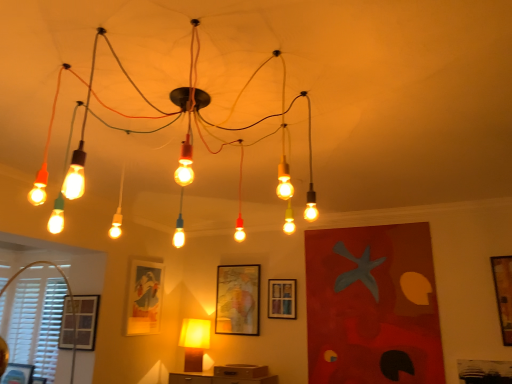
What do you see at coordinates (238, 300) in the screenshot? The height and width of the screenshot is (384, 512). I see `wooden framed map at center, marked as the 3th picture frame in a right-to-left arrangement` at bounding box center [238, 300].

This screenshot has width=512, height=384. Describe the element at coordinates (70, 298) in the screenshot. I see `white plastic blinds at lower left` at that location.

Identify the location of matte glass light fixture at center, the second lamp when ordered from bottom to top. (197, 93).

Describe the element at coordinates (194, 342) in the screenshot. I see `matte yellow lamp at center, the second lamp positioned from the top` at that location.

Describe the element at coordinates (282, 298) in the screenshot. The image size is (512, 384). I see `wooden picture frame at center, the fifth picture frame when ordered from left to right` at that location.

How much space does wooden picture frame at lower left, which is counted as the first picture frame, starting from the left, occupy vertically?

7.97 inches.

The width and height of the screenshot is (512, 384). What do you see at coordinates (144, 298) in the screenshot? I see `matte glass picture frame at center left, arranged as the third picture frame when viewed from the left` at bounding box center [144, 298].

You are a GUI agent. You are given a task and a screenshot of the screen. Output one action in this format:
    pyautogui.click(x=<x>, y=<y>)
    Task: Click on the matte black picture frame at lower left, the 5th picture frame positioned from the right
    
    Given the screenshot: What is the action you would take?
    pyautogui.click(x=86, y=320)

Are matte glass light fixture at center, the second lamp when ordered from bottom to top, and wooden picture frame at lower left, the 6th picture frame from the right, beside each other?

No, matte glass light fixture at center, the second lamp when ordered from bottom to top, is not beside wooden picture frame at lower left, the 6th picture frame from the right.

Considering the sizes of objects matte glass light fixture at center, the 1th lamp viewed from the front, and wooden picture frame at lower left, the 6th picture frame from the right, in the image provided, who is taller, matte glass light fixture at center, the 1th lamp viewed from the front, or wooden picture frame at lower left, the 6th picture frame from the right,?

Standing taller between the two is matte glass light fixture at center, the 1th lamp viewed from the front.

Considering the positions of objects matte glass light fixture at center, the first lamp when ordered from top to bottom, and wooden picture frame at lower left, which is counted as the first picture frame, starting from the left, in the image provided, who is in front, matte glass light fixture at center, the first lamp when ordered from top to bottom, or wooden picture frame at lower left, which is counted as the first picture frame, starting from the left,?

matte glass light fixture at center, the first lamp when ordered from top to bottom, is in front.

Visually, is matte glass light fixture at center, the second lamp when ordered from bottom to top, positioned to the left or to the right of wooden picture frame at lower left, which is counted as the first picture frame, starting from the left?

matte glass light fixture at center, the second lamp when ordered from bottom to top, is positioned on wooden picture frame at lower left, which is counted as the first picture frame, starting from the left,'s right side.

From the image's perspective, who appears lower, wooden picture frame at center, the 2th picture frame when ordered from right to left, or wooden picture frame at lower left, which is counted as the first picture frame, starting from the left?

wooden picture frame at lower left, which is counted as the first picture frame, starting from the left, is shown below in the image.

From a real-world perspective, is wooden picture frame at center, the 2th picture frame when ordered from right to left, positioned over wooden picture frame at lower left, which is counted as the first picture frame, starting from the left, based on gravity?

Yes, from a real-world perspective, wooden picture frame at center, the 2th picture frame when ordered from right to left, is above wooden picture frame at lower left, which is counted as the first picture frame, starting from the left.

Is wooden picture frame at center, the 2th picture frame when ordered from right to left, closer to camera compared to wooden picture frame at lower left, which is counted as the first picture frame, starting from the left?

That is False.

Is matte yellow lamp at center, which appears as the 2th lamp when viewed from the front, aimed at matte glass picture frame at center left, arranged as the third picture frame when viewed from the left?

No.

From a real-world perspective, who is located higher, matte yellow lamp at center, arranged as the 1th lamp when viewed from the back, or matte glass picture frame at center left, which appears as the fourth picture frame when viewed from the right?

From a 3D spatial view, matte glass picture frame at center left, which appears as the fourth picture frame when viewed from the right, is above.

Is matte glass picture frame at center left, which appears as the fourth picture frame when viewed from the right, inside the boundaries of wooden picture frame at center, the 2th picture frame when ordered from right to left, or outside?

matte glass picture frame at center left, which appears as the fourth picture frame when viewed from the right, lies outside wooden picture frame at center, the 2th picture frame when ordered from right to left.

From the image's perspective, which is below, matte glass picture frame at center left, which appears as the fourth picture frame when viewed from the right, or wooden picture frame at center, the 2th picture frame when ordered from right to left?

From the image's view, wooden picture frame at center, the 2th picture frame when ordered from right to left, is below.

Is matte glass picture frame at center left, which appears as the fourth picture frame when viewed from the right, shorter than wooden picture frame at center, the fifth picture frame when ordered from left to right?

No.

From a real-world perspective, who is located higher, matte glass picture frame at center left, which appears as the fourth picture frame when viewed from the right, or wooden picture frame at center, the 2th picture frame when ordered from right to left?

wooden picture frame at center, the 2th picture frame when ordered from right to left, from a real-world perspective.

Considering the sizes of objects matte black picture frame at lower left, the 5th picture frame positioned from the right, and white plastic blinds at lower left in the image provided, who is shorter, matte black picture frame at lower left, the 5th picture frame positioned from the right, or white plastic blinds at lower left?

matte black picture frame at lower left, the 5th picture frame positioned from the right.

Considering the relative sizes of matte black picture frame at lower left, the 5th picture frame positioned from the right, and white plastic blinds at lower left in the image provided, is matte black picture frame at lower left, the 5th picture frame positioned from the right, bigger than white plastic blinds at lower left?

Actually, matte black picture frame at lower left, the 5th picture frame positioned from the right, might be smaller than white plastic blinds at lower left.

Considering the positions of objects matte black picture frame at lower left, placed as the 2th picture frame when sorted from left to right, and white plastic blinds at lower left in the image provided, who is behind, matte black picture frame at lower left, placed as the 2th picture frame when sorted from left to right, or white plastic blinds at lower left?

white plastic blinds at lower left.

Is wooden picture frame at right, which is counted as the sixth picture frame, starting from the left, outside of matte glass light fixture at center, which is the second lamp in back-to-front order?

That's correct, wooden picture frame at right, which is counted as the sixth picture frame, starting from the left, is outside of matte glass light fixture at center, which is the second lamp in back-to-front order.

Looking at the image, does wooden picture frame at right, which ranks as the 1th picture frame in right-to-left order, seem bigger or smaller compared to matte glass light fixture at center, the second lamp when ordered from bottom to top?

wooden picture frame at right, which ranks as the 1th picture frame in right-to-left order, is smaller than matte glass light fixture at center, the second lamp when ordered from bottom to top.

Visually, is wooden picture frame at right, which ranks as the 1th picture frame in right-to-left order, positioned to the left or to the right of matte glass light fixture at center, which is the second lamp in back-to-front order?

wooden picture frame at right, which ranks as the 1th picture frame in right-to-left order, is to the right of matte glass light fixture at center, which is the second lamp in back-to-front order.

Between wooden picture frame at right, which ranks as the 1th picture frame in right-to-left order, and matte glass light fixture at center, the 1th lamp viewed from the front, which one has smaller width?

wooden picture frame at right, which ranks as the 1th picture frame in right-to-left order.

The height and width of the screenshot is (384, 512). There is a white plastic blinds at lower left. Find the location of `the 4th picture frame above it (from the image's perspective)`. the 4th picture frame above it (from the image's perspective) is located at coordinates (144, 298).

Which object is positioned more to the right, matte glass picture frame at center left, which appears as the fourth picture frame when viewed from the right, or white plastic blinds at lower left?

Positioned to the right is matte glass picture frame at center left, which appears as the fourth picture frame when viewed from the right.

Is matte glass picture frame at center left, arranged as the third picture frame when viewed from the left, beside white plastic blinds at lower left?

No, matte glass picture frame at center left, arranged as the third picture frame when viewed from the left, is not making contact with white plastic blinds at lower left.

Does matte glass picture frame at center left, which appears as the fourth picture frame when viewed from the right, contain white plastic blinds at lower left?

No, white plastic blinds at lower left is not surrounded by matte glass picture frame at center left, which appears as the fourth picture frame when viewed from the right.

At what (x,y) coordinates should I click in order to perform the action: click on the 3rd picture frame counting from the left side of the matte glass light fixture at center, the second lamp when ordered from bottom to top. Please return your answer as a coordinate pair (x, y). Image resolution: width=512 pixels, height=384 pixels. Looking at the image, I should click on (18, 374).

The height and width of the screenshot is (384, 512). There is a wooden picture frame at lower left, which is counted as the first picture frame, starting from the left. Find the location of `the 4th picture frame above it (from a real-world perspective)`. the 4th picture frame above it (from a real-world perspective) is located at coordinates (282, 298).

Considering their positions, is wooden framed map at center, which is the 4th picture frame in left-to-right order, positioned further to matte glass picture frame at center left, which appears as the fourth picture frame when viewed from the right, than matte black picture frame at lower left, placed as the 2th picture frame when sorted from left to right?

Among the two, wooden framed map at center, which is the 4th picture frame in left-to-right order, is located further to matte glass picture frame at center left, which appears as the fourth picture frame when viewed from the right.

Which object lies nearer to the anchor point wooden picture frame at lower left, the 6th picture frame from the right, matte glass light fixture at center, the first lamp when ordered from top to bottom, or wooden framed map at center, which is the 4th picture frame in left-to-right order?

wooden framed map at center, which is the 4th picture frame in left-to-right order.

Looking at the image, which one is located further to matte yellow lamp at center, which appears as the first lamp when ordered from the bottom, wooden framed map at center, marked as the 3th picture frame in a right-to-left arrangement, or white plastic blinds at lower left?

Among the two, white plastic blinds at lower left is located further to matte yellow lamp at center, which appears as the first lamp when ordered from the bottom.

Which object lies nearer to the anchor point matte glass picture frame at center left, arranged as the third picture frame when viewed from the left, wooden picture frame at center, the 2th picture frame when ordered from right to left, or white plastic blinds at lower left?

The object closer to matte glass picture frame at center left, arranged as the third picture frame when viewed from the left, is white plastic blinds at lower left.

From the image, which object appears to be farther from matte black picture frame at lower left, placed as the 2th picture frame when sorted from left to right, wooden picture frame at lower left, which is counted as the first picture frame, starting from the left, or matte glass light fixture at center, the 1th lamp viewed from the front?

matte glass light fixture at center, the 1th lamp viewed from the front, is further to matte black picture frame at lower left, placed as the 2th picture frame when sorted from left to right.

Looking at this image, when comparing their distances from wooden framed map at center, which is the 4th picture frame in left-to-right order, does matte black picture frame at lower left, the 5th picture frame positioned from the right, or wooden picture frame at center, the fifth picture frame when ordered from left to right, seem further?

matte black picture frame at lower left, the 5th picture frame positioned from the right, lies further to wooden framed map at center, which is the 4th picture frame in left-to-right order, than the other object.

Estimate the real-world distances between objects in this image. Which object is further from wooden framed map at center, which is the 4th picture frame in left-to-right order, matte glass light fixture at center, the 1th lamp viewed from the front, or matte yellow lamp at center, which appears as the first lamp when ordered from the bottom?

matte glass light fixture at center, the 1th lamp viewed from the front, is positioned further to the anchor wooden framed map at center, which is the 4th picture frame in left-to-right order.

Based on their spatial positions, is wooden picture frame at lower left, which is counted as the first picture frame, starting from the left, or matte glass picture frame at center left, which appears as the fourth picture frame when viewed from the right, closer to wooden picture frame at right, which ranks as the 1th picture frame in right-to-left order?

Based on the image, matte glass picture frame at center left, which appears as the fourth picture frame when viewed from the right, appears to be nearer to wooden picture frame at right, which ranks as the 1th picture frame in right-to-left order.

The width and height of the screenshot is (512, 384). Identify the location of window located between matte glass light fixture at center, the first lamp when ordered from top to bottom, and matte yellow lamp at center, arranged as the 1th lamp when viewed from the back, in the depth direction. (70, 298).

This screenshot has height=384, width=512. In order to click on window located between matte glass light fixture at center, the second lamp when ordered from bottom to top, and wooden framed map at center, which is the 4th picture frame in left-to-right order, in the depth direction in this screenshot , I will do `click(70, 298)`.

This screenshot has width=512, height=384. In order to click on picture frame between matte yellow lamp at center, arranged as the 1th lamp when viewed from the back, and wooden picture frame at center, the fifth picture frame when ordered from left to right, in the horizontal direction in this screenshot , I will do `click(238, 300)`.

Identify the location of window between wooden picture frame at lower left, the 6th picture frame from the right, and wooden picture frame at center, the 2th picture frame when ordered from right to left. (70, 298).